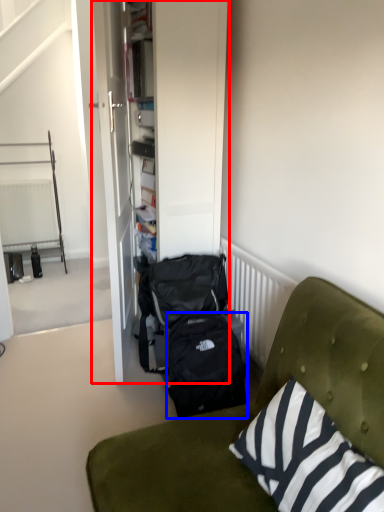
Question: Which of the following is the closest to the observer, armoire (highlighted by a red box) or backpack (highlighted by a blue box)?

Choices:
 (A) armoire
 (B) backpack

Answer: (B)